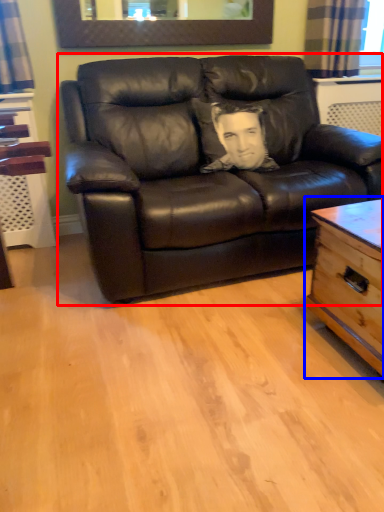
Question: Among these objects, which one is nearest to the camera, studio couch (highlighted by a red box) or table (highlighted by a blue box)?

Choices:
 (A) studio couch
 (B) table

Answer: (B)